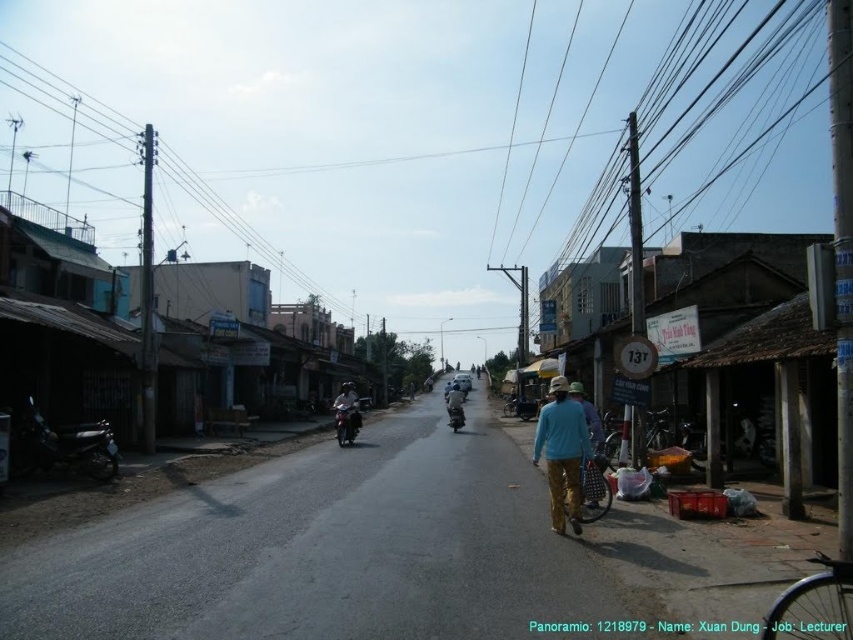
Who is lower down, light blue fabric shirt at center or blue fabric bag at center?

light blue fabric shirt at center

Between light blue fabric shirt at center and blue fabric bag at center, which one appears on the right side from the viewer's perspective?

blue fabric bag at center

Where is `light blue fabric shirt at center`? This screenshot has width=853, height=640. light blue fabric shirt at center is located at coordinates (561, 452).

In the scene shown: Can you confirm if wooden shopfronts at left is bigger than matte black motorcycle at center?

Correct, wooden shopfronts at left is larger in size than matte black motorcycle at center.

Does wooden shopfronts at left have a greater height compared to matte black motorcycle at center?

Yes.

What do you see at coordinates (68, 324) in the screenshot? I see `wooden shopfronts at left` at bounding box center [68, 324].

Locate an element on the screen. This screenshot has height=640, width=853. wooden shopfronts at left is located at coordinates (68, 324).

Does light blue fabric shirt at center have a smaller size compared to matte black motorcycle at center?

Correct, light blue fabric shirt at center occupies less space than matte black motorcycle at center.

Is point (556, 483) farther from camera compared to point (450, 412)?

No, (556, 483) is in front of (450, 412).

This screenshot has height=640, width=853. I want to click on light blue fabric shirt at center, so click(x=561, y=452).